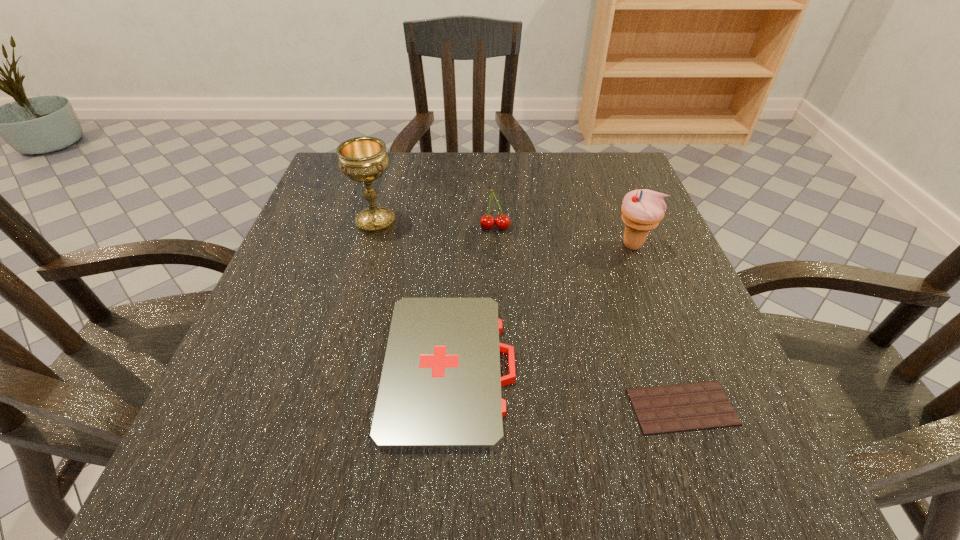
The height and width of the screenshot is (540, 960). I want to click on free location located 0.380m on the back of the shortest object, so click(615, 222).

This screenshot has width=960, height=540. In order to click on object present at the far edge in this screenshot , I will do `click(362, 159)`.

You are a GUI agent. You are given a task and a screenshot of the screen. Output one action in this format:
    pyautogui.click(x=<x>, y=<y>)
    Task: Click on the first-aid kit that is at the near edge
    This screenshot has height=540, width=960.
    Given the screenshot: What is the action you would take?
    pyautogui.click(x=440, y=389)

The height and width of the screenshot is (540, 960). What are the coordinates of `chocolate bar that is positioned at the near edge` in the screenshot? It's located at (695, 406).

At what (x,y) coordinates should I click in order to perform the action: click on object that is at the left edge. Please return your answer as a coordinate pair (x, y). Image resolution: width=960 pixels, height=540 pixels. Looking at the image, I should click on (362, 159).

The height and width of the screenshot is (540, 960). In order to click on icecream at the right edge in this screenshot , I will do `click(642, 210)`.

Find the location of `chocolate bar that is positioned at the right edge`. chocolate bar that is positioned at the right edge is located at coordinates (695, 406).

Locate an element on the screen. object at the far left corner is located at coordinates (362, 159).

Find the location of a particular element. object at the near right corner is located at coordinates (695, 406).

Identify the location of free space at the far edge of the desktop. The height and width of the screenshot is (540, 960). (456, 201).